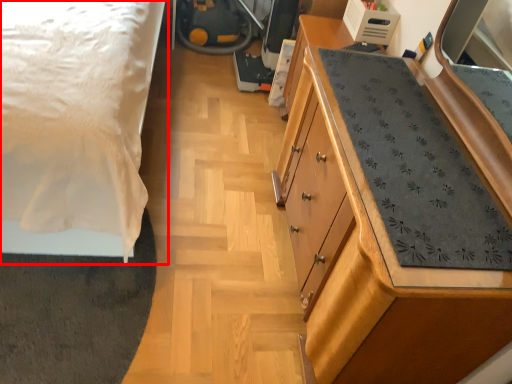
Question: From the image's perspective, where is bed (annotated by the red box) located relative to chest of drawers?

Choices:
 (A) above
 (B) below

Answer: (A)